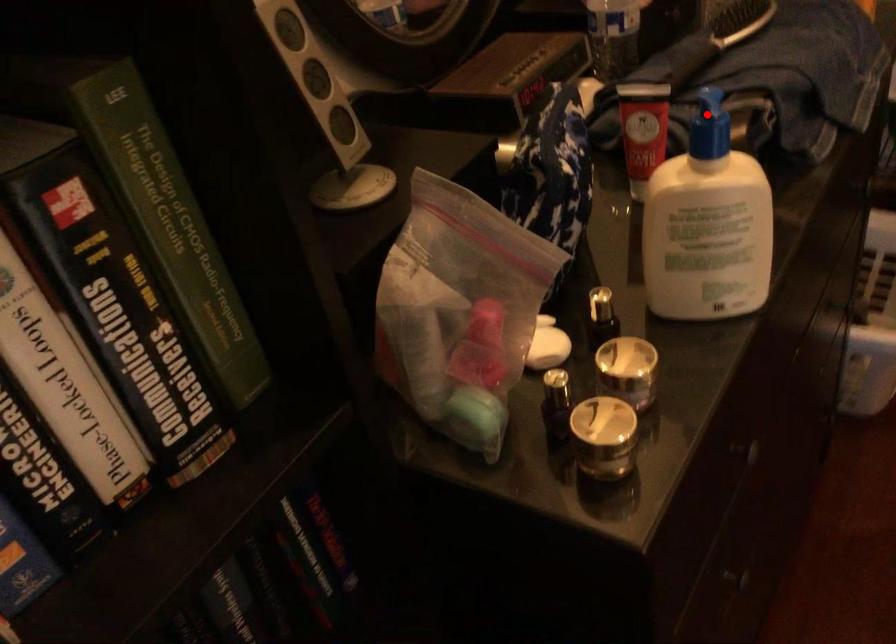
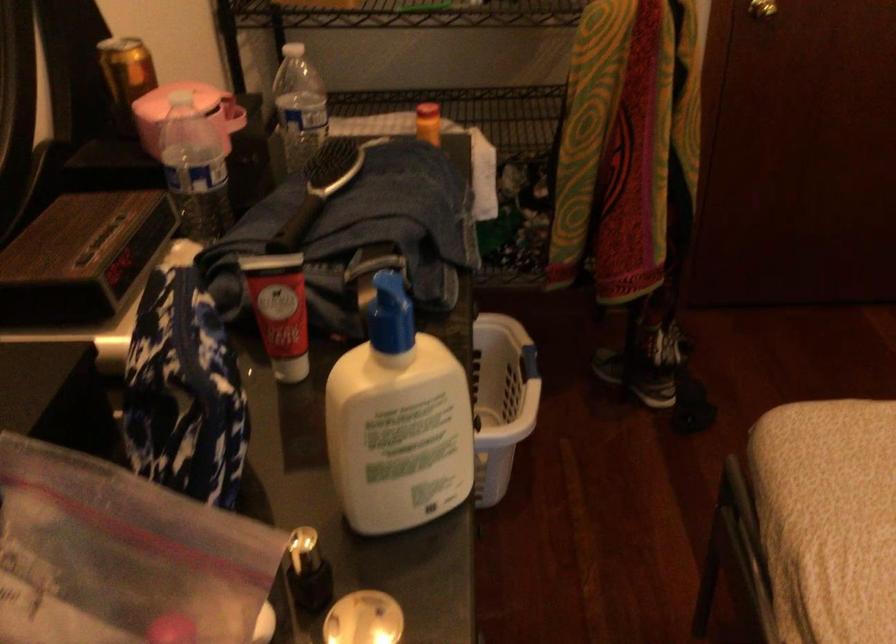
Question: I am providing you with two images of the same scene from different viewpoints. A red point is shown in image1. For the corresponding object point in image2, is it positioned nearer or farther from the camera?

Choices:
 (A) Nearer
 (B) Farther

Answer: (A)